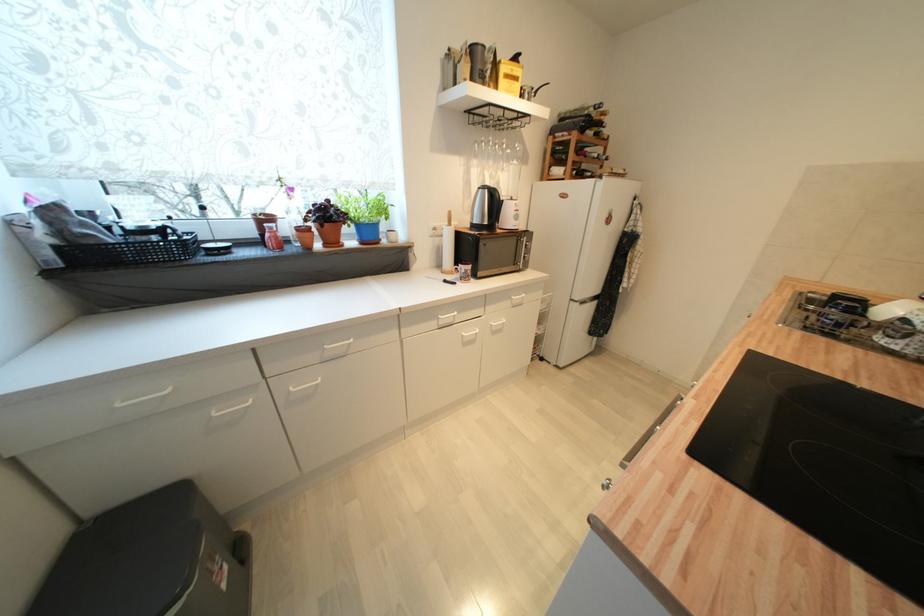
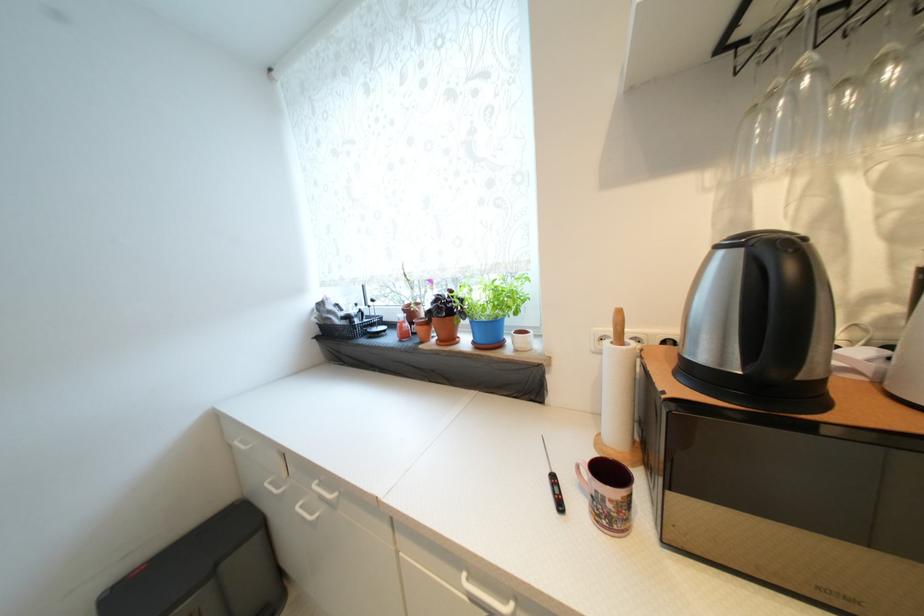
In the second image, find the point that corresponds to point 331,246 in the first image.

(445, 342)